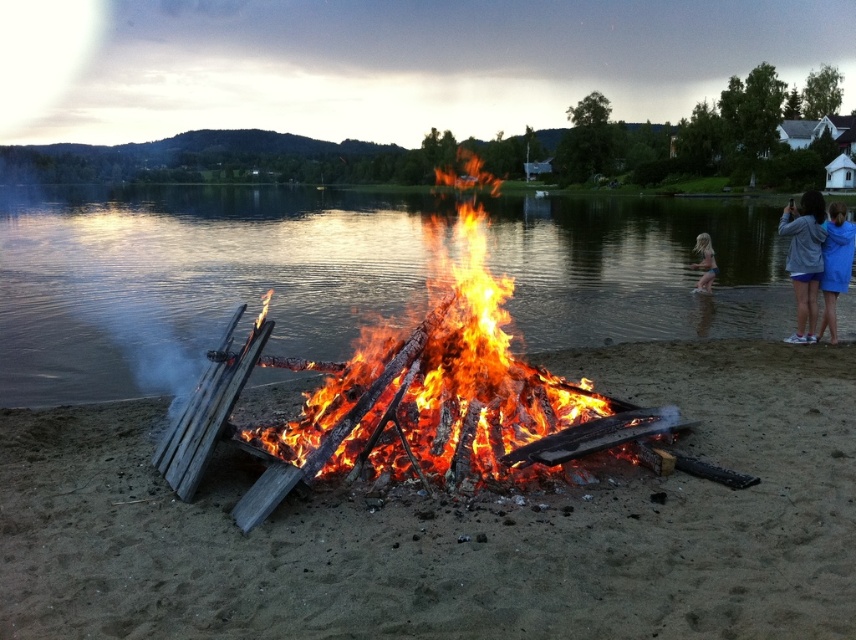
Question: Based on their relative distances, which object is nearer to the gray fabric at right?

Choices:
 (A) brown sandy beach at center
 (B) blue fabric dress at right
 (C) light blue denim shorts at lower right
 (D) charred wood fire at center

Answer: (B)

Question: Does brown sandy beach at center appear on the right side of blue fabric dress at right?

Choices:
 (A) yes
 (B) no

Answer: (B)

Question: Does brown sandy beach at center have a smaller size compared to gray fabric at right?

Choices:
 (A) no
 (B) yes

Answer: (B)

Question: Which is nearer to the transparent water at center?

Choices:
 (A) charred wood fire at center
 (B) gray fabric at right
 (C) light blue denim shorts at lower right

Answer: (A)

Question: Which object is positioned closest to the charred wood fire at center?

Choices:
 (A) brown sandy beach at center
 (B) transparent water at center
 (C) light blue denim shorts at lower right

Answer: (C)

Question: Can you confirm if gray fabric at right is smaller than blue fabric dress at right?

Choices:
 (A) no
 (B) yes

Answer: (A)